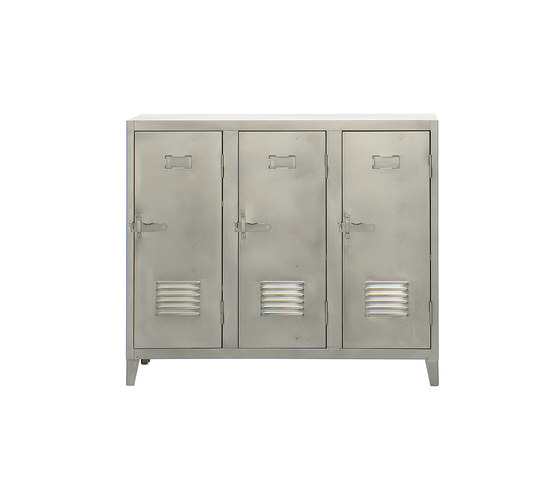
Find the location of `door`. door is located at coordinates (202, 241), (270, 248), (378, 245).